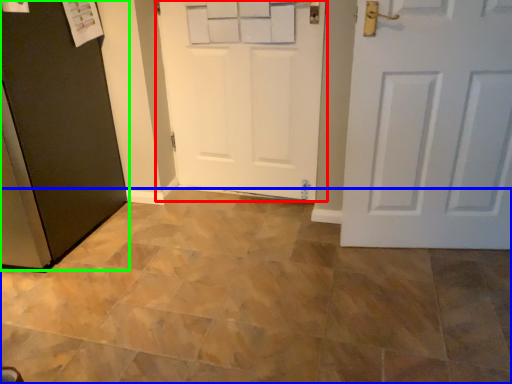
Question: Estimate the real-world distances between objects in this image. Which object is farther from door (highlighted by a red box), ceramic tile (highlighted by a blue box) or door (highlighted by a green box)?

Choices:
 (A) ceramic tile
 (B) door

Answer: (A)